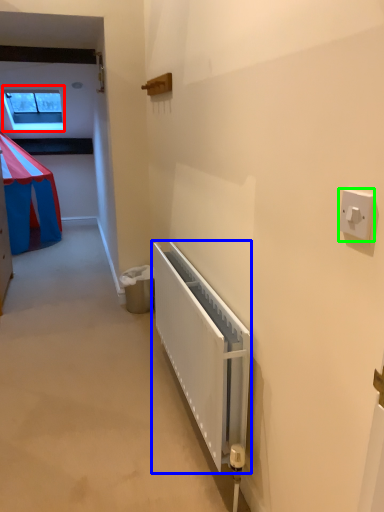
Question: Considering the real-world distances, which object is closest to window (highlighted by a red box)? radiator (highlighted by a blue box) or light switch (highlighted by a green box).

Choices:
 (A) radiator
 (B) light switch

Answer: (A)